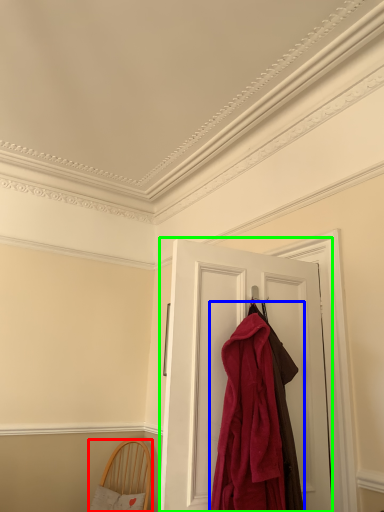
Question: Considering the real-world distances, which object is closest to furniture (highlighted by a red box)? cloak (highlighted by a blue box) or door (highlighted by a green box).

Choices:
 (A) cloak
 (B) door

Answer: (B)